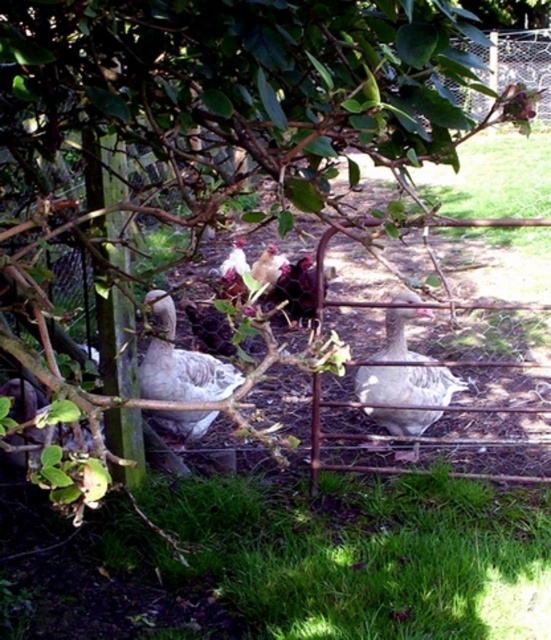
You are standing in the rural scene and want to take a photo of both the white matte goose at center and the white glossy chicken at center. Which one will appear larger in your photo?

The white matte goose at center will appear larger in the photo because it is closer to the viewer than the white glossy chicken at center.

You are a small animal trying to cross from the lower left to the lower right of the image. There is green grass at lower center and a gray matte duck at center. Which obstacle would you encounter first?

The gray matte duck at center is smaller than the green grass at lower center, so you would encounter the gray matte duck at center first since it is closer to your path.

You are standing in the fenced area and want to see the white glossy chicken at center clearly. The gray matte duck at center is blocking your view. Can you move around the duck to get a clear view of the chicken?

The gray matte duck at center is in front of the white glossy chicken at center, so moving around the duck should allow you to see the chicken clearly.